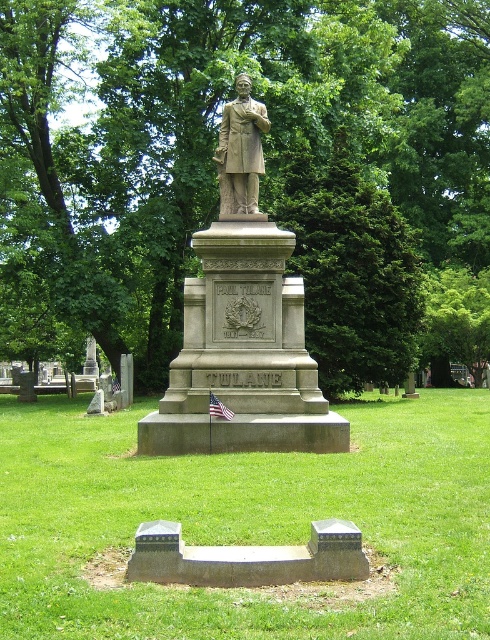
Between smooth concrete bench at center and bronze statue at center, which one is positioned higher?

bronze statue at center is above.

Is point (431, 419) in front of point (237, 100)?

No, it is not.

Locate an element on the screen. This screenshot has width=490, height=640. smooth concrete bench at center is located at coordinates (245, 522).

Does point (244, 20) lie in front of point (161, 506)?

No.

Is point (131, 134) farther from camera compared to point (101, 614)?

Yes, it is.

Is point (343, 285) less distant than point (288, 525)?

That is False.

The height and width of the screenshot is (640, 490). Identify the location of green leafy tree at center. (249, 173).

Is gray stone statue at center below bronze statue at center?

Yes, gray stone statue at center is below bronze statue at center.

Who is taller, gray stone statue at center or bronze statue at center?

With more height is gray stone statue at center.

Is point (291, 312) positioned before point (256, 198)?

That is True.

Locate an element on the screen. This screenshot has width=490, height=640. gray stone statue at center is located at coordinates (243, 292).